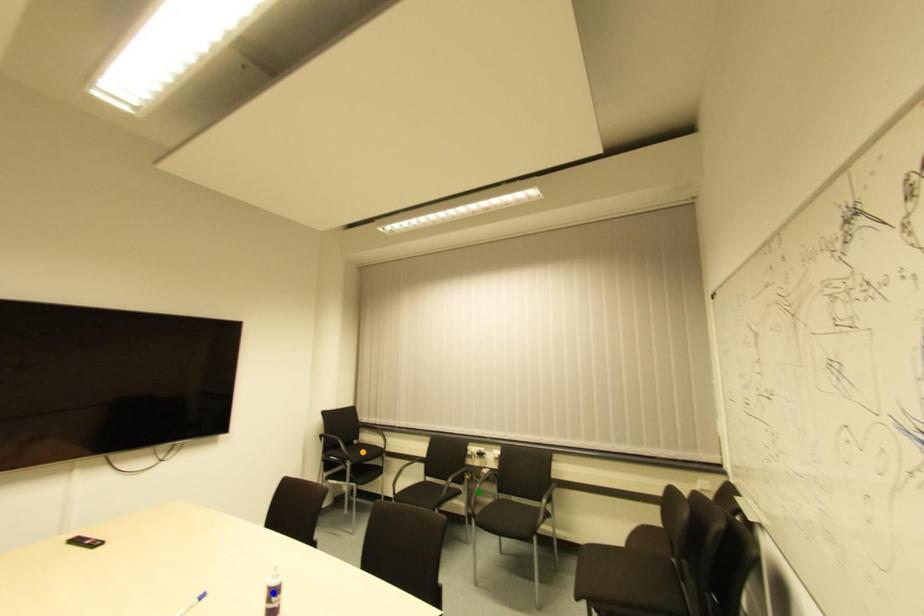
Order these from nearest to farthest:
green point
orange point
blue point

blue point → green point → orange point